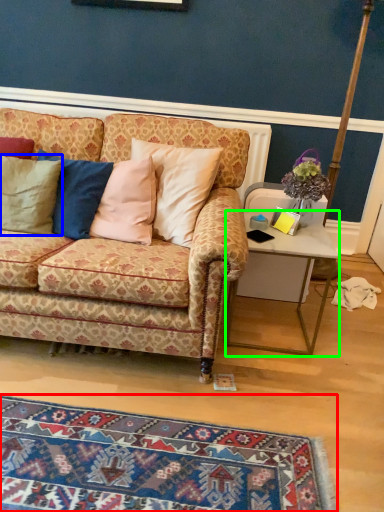
Question: Which is nearer to the mat (highlighted by a red box)? pillow (highlighted by a blue box) or desk (highlighted by a green box).

Choices:
 (A) pillow
 (B) desk

Answer: (B)